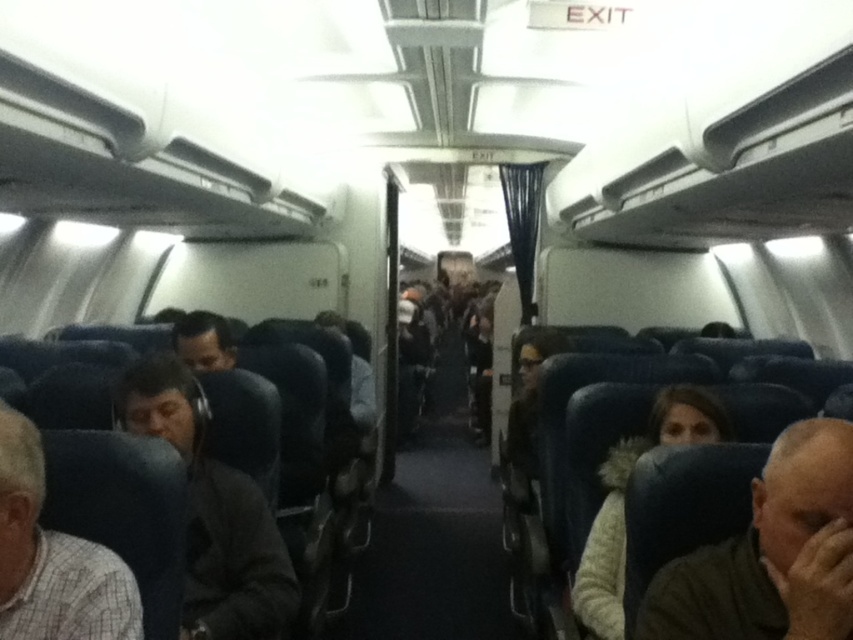
You are seated in an airplane cabin and want to reach the black matte headphones at left. The armrest between you and the headphones is 1.5 meters wide. Can you extend your arm to grab them without moving your seat?

The black matte headphones at left are 1.59 meters away from you. Since the armrest is only 1.5 meters wide, you cannot reach them by extending your arm without moving your seat.

You are a flight attendant walking down the aisle of the airplane cabin. You notice a dark gray fabric headrest at lower right and a white checkered shirt at left. Which object is closer to the front of the cabin?

The dark gray fabric headrest at lower right is in front of the white checkered shirt at left, so it is closer to the front of the cabin.

You are a passenger sitting in the airplane cabin and want to reach both the point at coordinate (250, 557) and the point at coordinate (21, 604). Which point is closer to you?

Point (21, 604) is closer to you because it is nearer to the camera perspective, which is where you are sitting in the airplane cabin.